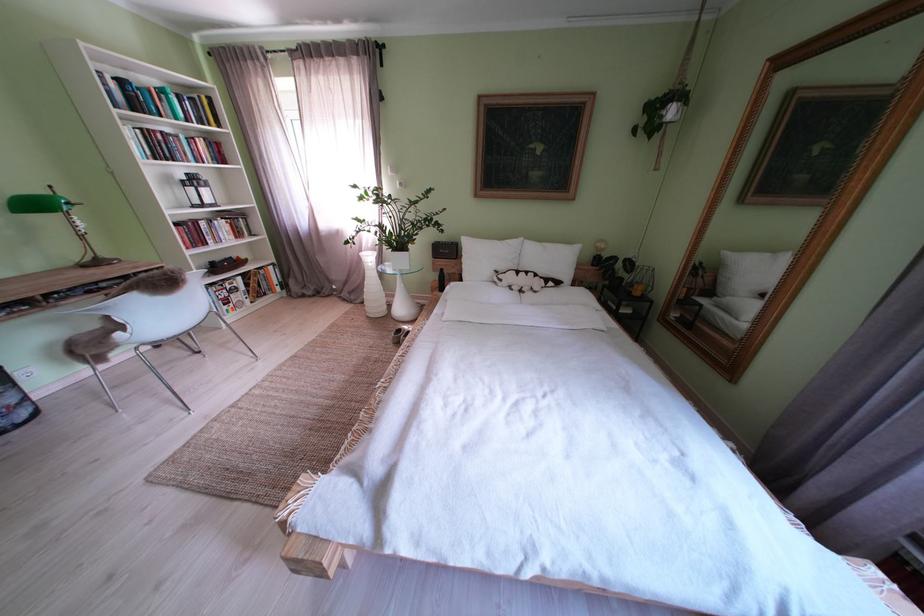
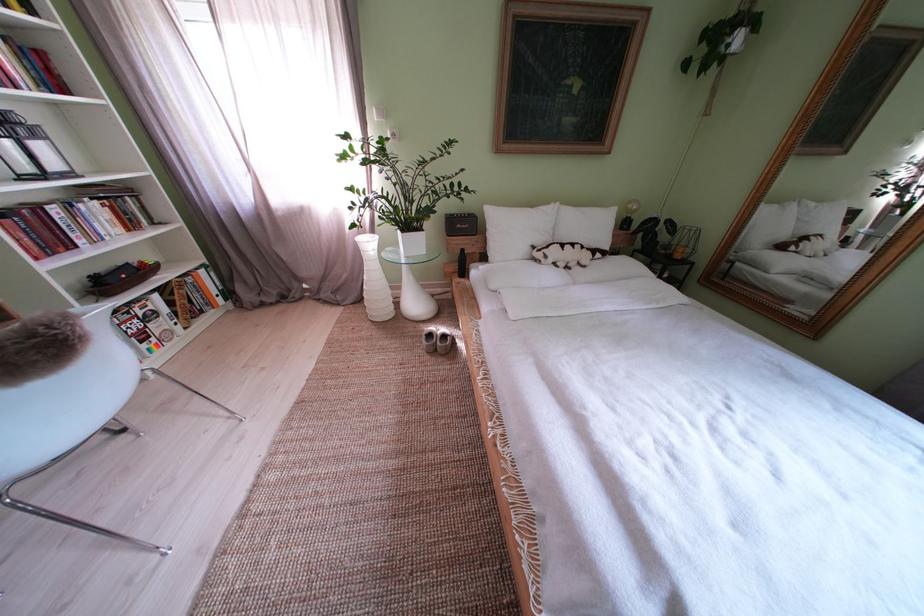
What movement of the cameraman would produce the second image?

The cameraman moved toward left, forward.